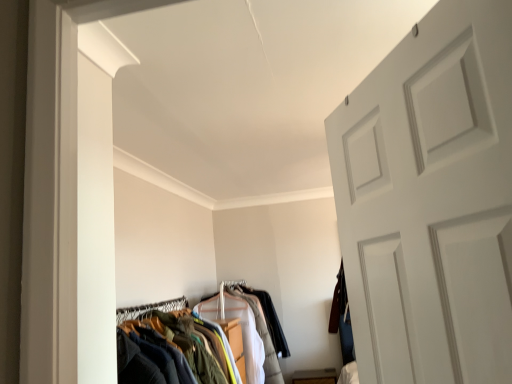
Question: Could you tell me if white cotton shirt at center is facing textured fabric clothes at center?

Choices:
 (A) no
 (B) yes

Answer: (A)

Question: Does white cotton shirt at center have a larger size compared to textured fabric clothes at center?

Choices:
 (A) yes
 (B) no

Answer: (A)

Question: Does white cotton shirt at center lie in front of textured fabric clothes at center?

Choices:
 (A) yes
 (B) no

Answer: (B)

Question: Is white cotton shirt at center next to textured fabric clothes at center and touching it?

Choices:
 (A) no
 (B) yes

Answer: (A)

Question: From a real-world perspective, is white cotton shirt at center physically below textured fabric clothes at center?

Choices:
 (A) no
 (B) yes

Answer: (B)

Question: From the image's perspective, is white cotton shirt at center above textured fabric clothes at center?

Choices:
 (A) yes
 (B) no

Answer: (B)

Question: Is textured fabric clothes at center at the left side of white cotton shirt at center?

Choices:
 (A) yes
 (B) no

Answer: (A)

Question: Does textured fabric clothes at center turn towards white cotton shirt at center?

Choices:
 (A) no
 (B) yes

Answer: (A)

Question: From a real-world perspective, is textured fabric clothes at center located higher than white cotton shirt at center?

Choices:
 (A) yes
 (B) no

Answer: (A)

Question: Can you confirm if textured fabric clothes at center is bigger than white cotton shirt at center?

Choices:
 (A) no
 (B) yes

Answer: (A)

Question: Considering the relative sizes of textured fabric clothes at center and white cotton shirt at center in the image provided, is textured fabric clothes at center wider than white cotton shirt at center?

Choices:
 (A) no
 (B) yes

Answer: (A)

Question: Would you say white cotton shirt at center is part of textured fabric clothes at center's contents?

Choices:
 (A) yes
 (B) no

Answer: (B)

Question: From their relative heights in the image, would you say white cotton shirt at center is taller or shorter than textured fabric clothes at center?

Choices:
 (A) tall
 (B) short

Answer: (A)